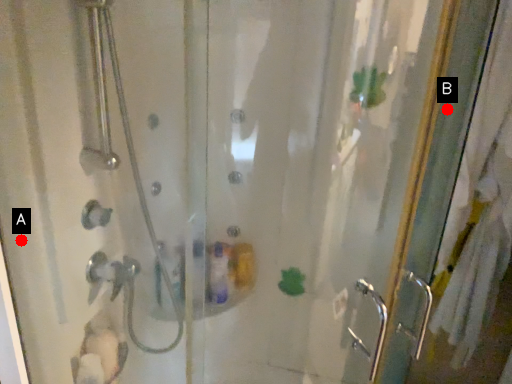
Question: Two points are circled on the image, labeled by A and B beside each circle. Which of the following is the closest to the observer?

Choices:
 (A) A is closer
 (B) B is closer

Answer: (A)